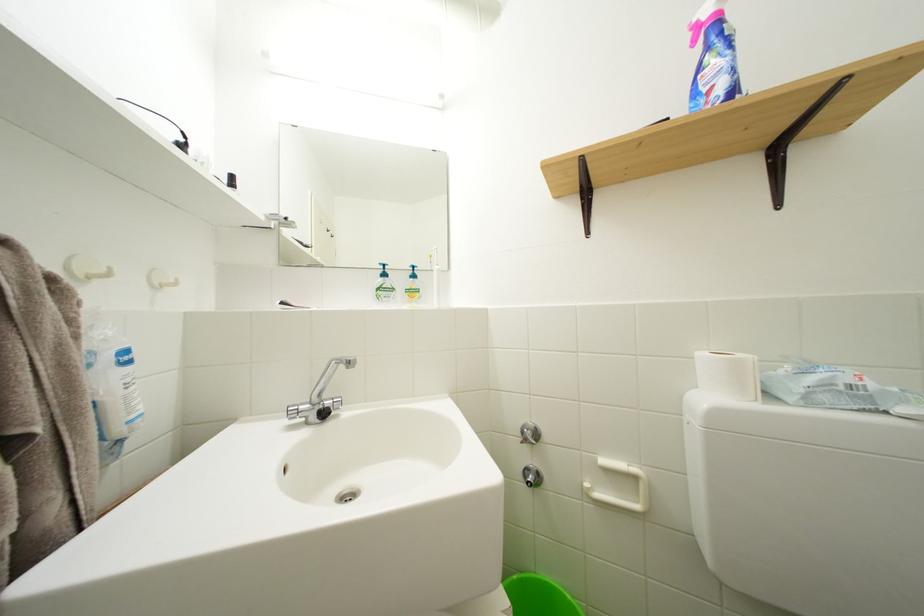
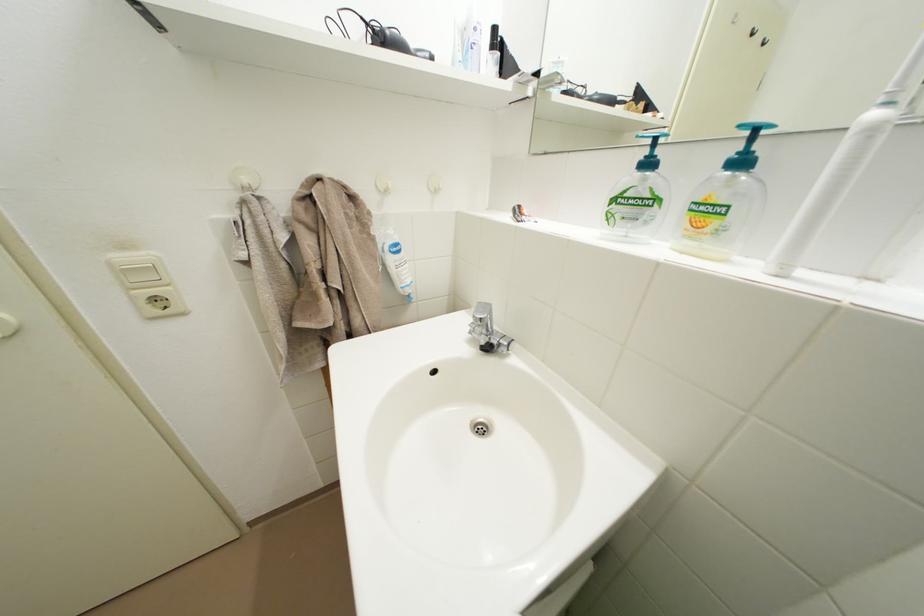
The first image is from the beginning of the video and the second image is from the end. How did the camera likely rotate when shooting the video?

The camera's rotation is toward left-down.